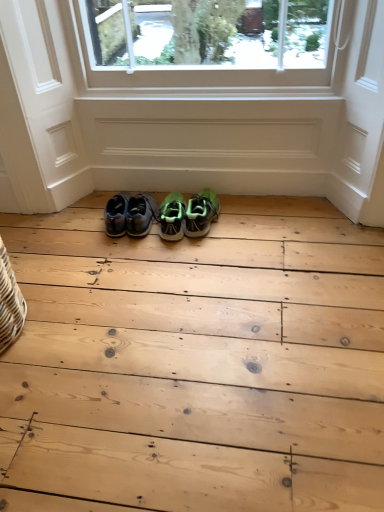
Question: Does green matte sneakers at center, which appears as the 2th footwear when viewed from the left, turn towards green mesh sneakers at center, which ranks as the 1th footwear in right-to-left order?

Choices:
 (A) no
 (B) yes

Answer: (A)

Question: Considering the relative sizes of green matte sneakers at center, which is the second footwear in right-to-left order, and green mesh sneakers at center, which is the third footwear in left-to-right order, in the image provided, is green matte sneakers at center, which is the second footwear in right-to-left order, shorter than green mesh sneakers at center, which is the third footwear in left-to-right order,?

Choices:
 (A) no
 (B) yes

Answer: (A)

Question: Can you confirm if green matte sneakers at center, which appears as the 2th footwear when viewed from the left, is positioned to the right of green mesh sneakers at center, which ranks as the 1th footwear in right-to-left order?

Choices:
 (A) yes
 (B) no

Answer: (B)

Question: Is there a large distance between green matte sneakers at center, which is the second footwear in right-to-left order, and green mesh sneakers at center, which is the third footwear in left-to-right order?

Choices:
 (A) no
 (B) yes

Answer: (A)

Question: Is green matte sneakers at center, which is the second footwear in right-to-left order, bigger than green mesh sneakers at center, which ranks as the 1th footwear in right-to-left order?

Choices:
 (A) yes
 (B) no

Answer: (A)

Question: Considering the relative sizes of green matte sneakers at center, which is the second footwear in right-to-left order, and green mesh sneakers at center, which is the third footwear in left-to-right order, in the image provided, is green matte sneakers at center, which is the second footwear in right-to-left order, wider than green mesh sneakers at center, which is the third footwear in left-to-right order,?

Choices:
 (A) yes
 (B) no

Answer: (A)

Question: From the image's perspective, is green matte sneakers at center, which appears as the 2th footwear when viewed from the left, above matte black sneakers at center, acting as the 1th footwear starting from the left?

Choices:
 (A) yes
 (B) no

Answer: (B)

Question: Is green matte sneakers at center, which is the second footwear in right-to-left order, oriented away from matte black sneakers at center, acting as the 3th footwear starting from the right?

Choices:
 (A) yes
 (B) no

Answer: (B)

Question: Can you confirm if green matte sneakers at center, which is the second footwear in right-to-left order, is bigger than matte black sneakers at center, acting as the 1th footwear starting from the left?

Choices:
 (A) no
 (B) yes

Answer: (A)

Question: Is green matte sneakers at center, which appears as the 2th footwear when viewed from the left, at the left side of matte black sneakers at center, acting as the 3th footwear starting from the right?

Choices:
 (A) yes
 (B) no

Answer: (B)

Question: From a real-world perspective, is green matte sneakers at center, which appears as the 2th footwear when viewed from the left, located higher than matte black sneakers at center, acting as the 1th footwear starting from the left?

Choices:
 (A) yes
 (B) no

Answer: (B)

Question: Is green matte sneakers at center, which is the second footwear in right-to-left order, next to matte black sneakers at center, acting as the 1th footwear starting from the left?

Choices:
 (A) no
 (B) yes

Answer: (B)

Question: Considering the relative positions of matte black sneakers at center, acting as the 1th footwear starting from the left, and green mesh sneakers at center, which ranks as the 1th footwear in right-to-left order, in the image provided, is matte black sneakers at center, acting as the 1th footwear starting from the left, to the left of green mesh sneakers at center, which ranks as the 1th footwear in right-to-left order, from the viewer's perspective?

Choices:
 (A) no
 (B) yes

Answer: (B)